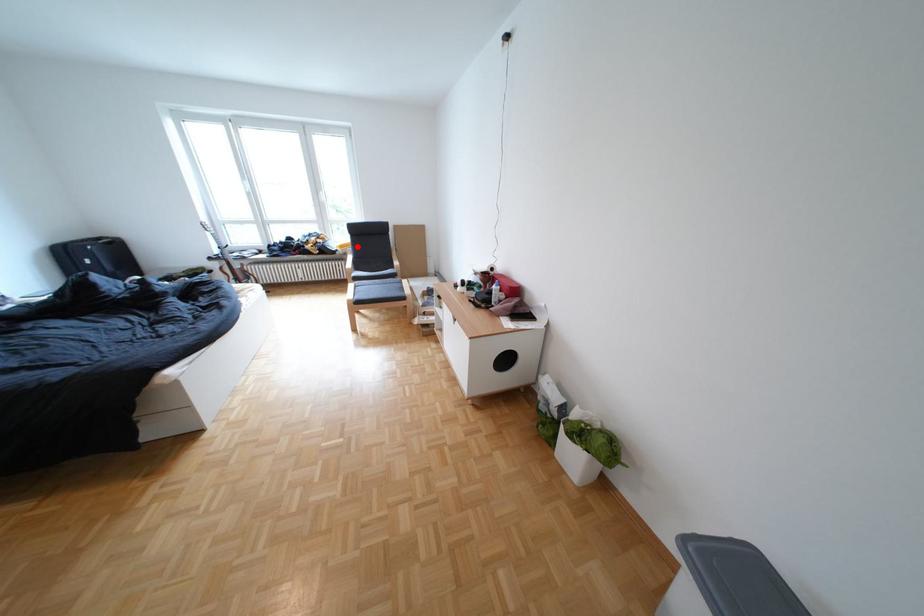
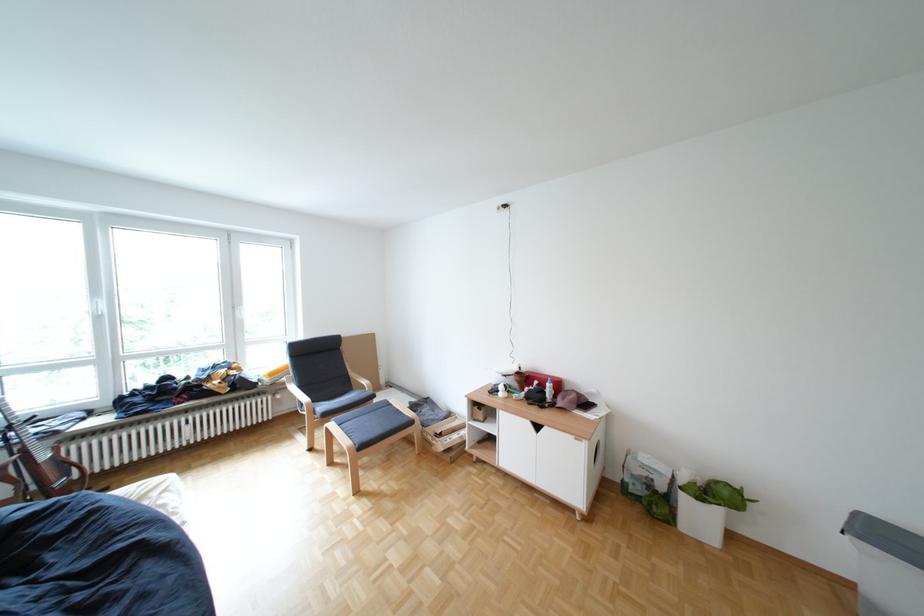
Question: I am providing you with two images of the same scene from different viewpoints. Given a red point in image1, look at the same physical point in image2. Is it:

Choices:
 (A) Closer to the viewpoint
 (B) Farther from the viewpoint

Answer: (B)